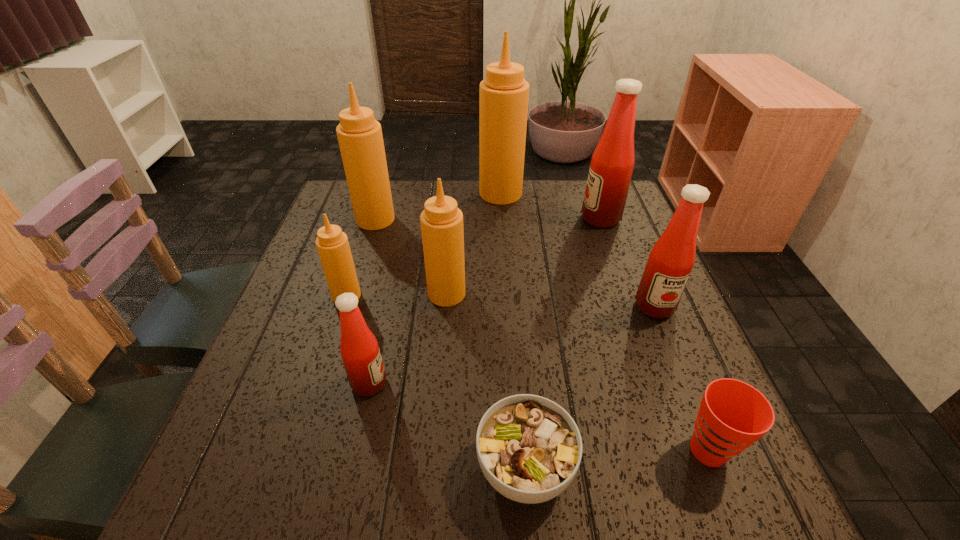
Locate which red condiment is the third closest to the cup. Please provide its 2D coordinates. Your answer should be formatted as a tuple, i.e. [(x, y)], where the tuple contains the x and y coordinates of a point satisfying the conditions above.

[(612, 163)]

The height and width of the screenshot is (540, 960). Find the location of `free spot that satisfies the following two spatial constraints: 1. on the front-facing side of the biggest red condiment; 2. on the front side of the shortest object`. free spot that satisfies the following two spatial constraints: 1. on the front-facing side of the biggest red condiment; 2. on the front side of the shortest object is located at coordinates (689, 468).

Where is `vacant area that satisfies the following two spatial constraints: 1. on the front-facing side of the farthest red condiment; 2. on the front side of the smallest tan condiment`? The width and height of the screenshot is (960, 540). vacant area that satisfies the following two spatial constraints: 1. on the front-facing side of the farthest red condiment; 2. on the front side of the smallest tan condiment is located at coordinates (628, 296).

You are a GUI agent. You are given a task and a screenshot of the screen. Output one action in this format:
    pyautogui.click(x=<x>, y=<y>)
    Task: Click on the blank area in the image that satisfies the following two spatial constraints: 1. on the front side of the tallest condiment; 2. on the left side of the eighth tallest object
    The height and width of the screenshot is (540, 960).
    Given the screenshot: What is the action you would take?
    pyautogui.click(x=517, y=450)